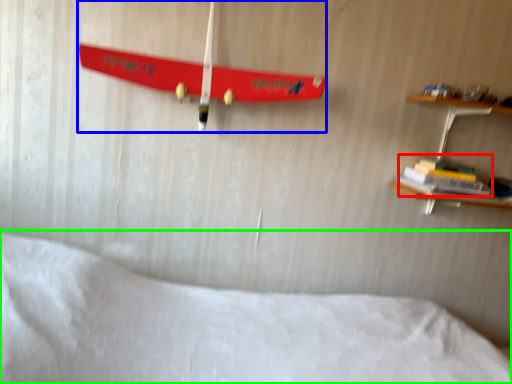
Question: Which object is the farthest from book (highlighted by a red box)? Choose among these: skateboard (highlighted by a blue box) or bed (highlighted by a green box).

Choices:
 (A) skateboard
 (B) bed

Answer: (B)